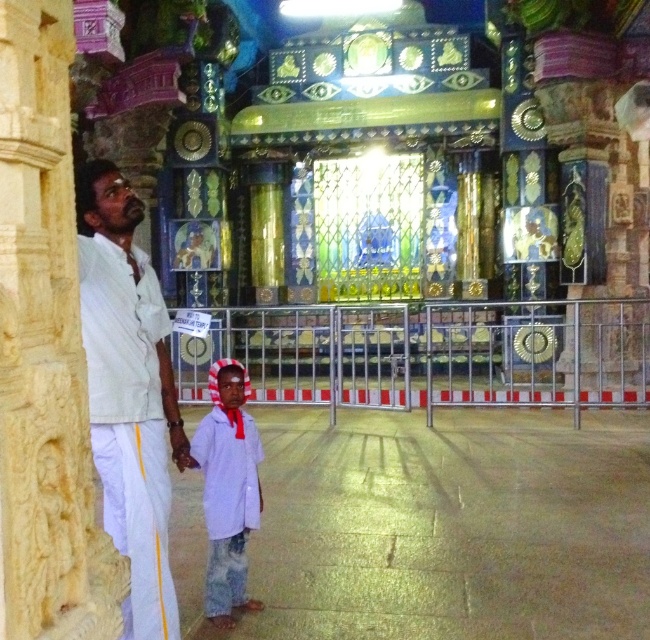
Question: Is white cotton shirt at left closer to camera compared to white cotton shirt at center?

Choices:
 (A) no
 (B) yes

Answer: (B)

Question: Which point is closer to the camera taking this photo?

Choices:
 (A) (242, 573)
 (B) (110, 291)

Answer: (B)

Question: Is white cotton shirt at left below white cotton shirt at center?

Choices:
 (A) yes
 (B) no

Answer: (B)

Question: Which point is farther from the camera taking this photo?

Choices:
 (A) (203, 520)
 (B) (112, 353)

Answer: (A)

Question: Does white cotton shirt at left appear over white cotton shirt at center?

Choices:
 (A) yes
 (B) no

Answer: (A)